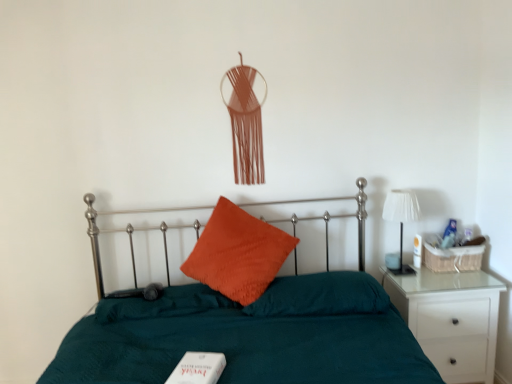
Question: Is teal fabric bed at center surrounding white matte book at lower center?

Choices:
 (A) no
 (B) yes

Answer: (B)

Question: Does teal fabric bed at center come behind white matte book at lower center?

Choices:
 (A) yes
 (B) no

Answer: (B)

Question: Is teal fabric bed at center beside white matte book at lower center?

Choices:
 (A) no
 (B) yes

Answer: (A)

Question: Is teal fabric bed at center to the left of white matte book at lower center from the viewer's perspective?

Choices:
 (A) yes
 (B) no

Answer: (B)

Question: From the image's perspective, is teal fabric bed at center on top of white matte book at lower center?

Choices:
 (A) no
 (B) yes

Answer: (A)

Question: From their relative heights in the image, would you say white fabric lampshade at right is taller or shorter than white glossy nightstand at right?

Choices:
 (A) short
 (B) tall

Answer: (A)

Question: From a real-world perspective, is white fabric lampshade at right above or below white glossy nightstand at right?

Choices:
 (A) above
 (B) below

Answer: (A)

Question: Is white fabric lampshade at right spatially inside white glossy nightstand at right, or outside of it?

Choices:
 (A) inside
 (B) outside

Answer: (B)

Question: In the image, is white fabric lampshade at right on the left side or the right side of white glossy nightstand at right?

Choices:
 (A) right
 (B) left

Answer: (B)

Question: Is point (185, 380) positioned closer to the camera than point (268, 354)?

Choices:
 (A) farther
 (B) closer

Answer: (B)

Question: Considering the positions of white matte book at lower center and teal fabric bed at center in the image, is white matte book at lower center wider or thinner than teal fabric bed at center?

Choices:
 (A) thin
 (B) wide

Answer: (A)

Question: Is white matte book at lower center taller or shorter than teal fabric bed at center?

Choices:
 (A) tall
 (B) short

Answer: (B)

Question: Would you say white matte book at lower center is to the left or to the right of teal fabric bed at center in the picture?

Choices:
 (A) right
 (B) left

Answer: (B)

Question: From their relative heights in the image, would you say orange velvet pillow at center, which is the first pillow from right to left, is taller or shorter than teal fabric bed at center?

Choices:
 (A) tall
 (B) short

Answer: (B)

Question: Is orange velvet pillow at center, which is the first pillow from right to left, in front of or behind teal fabric bed at center in the image?

Choices:
 (A) front
 (B) behind

Answer: (B)